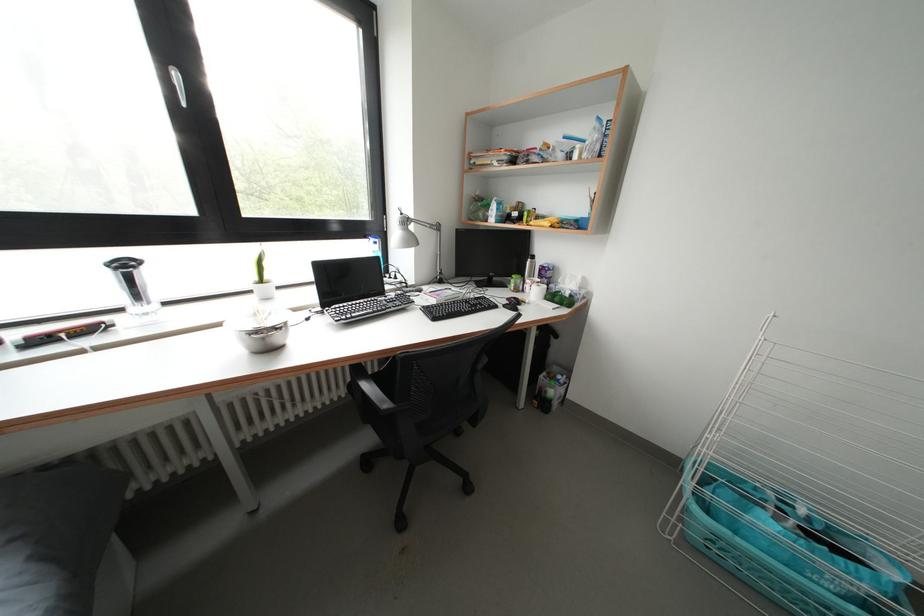
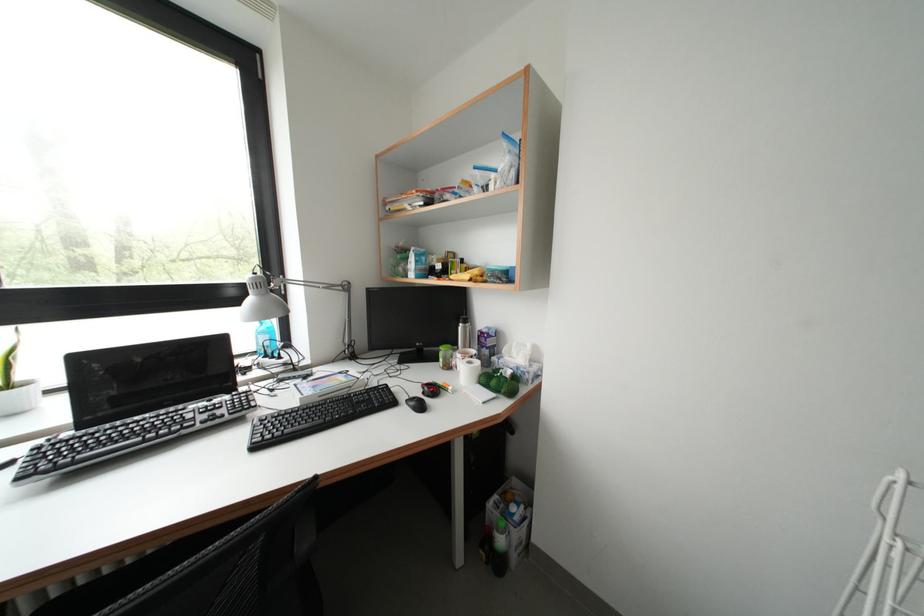
In the second image, find the point that corresponds to pixel 408 219 in the first image.

(261, 278)